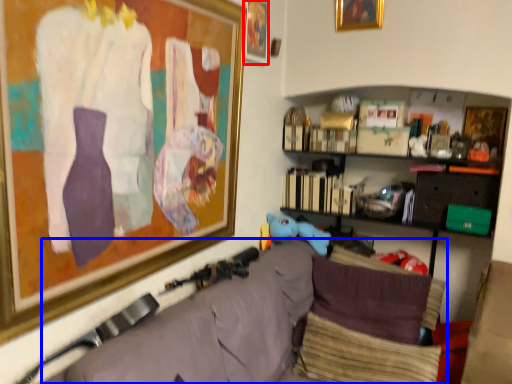
Question: Which object is closer to the camera taking this photo, picture frame (highlighted by a red box) or couch (highlighted by a blue box)?

Choices:
 (A) picture frame
 (B) couch

Answer: (B)